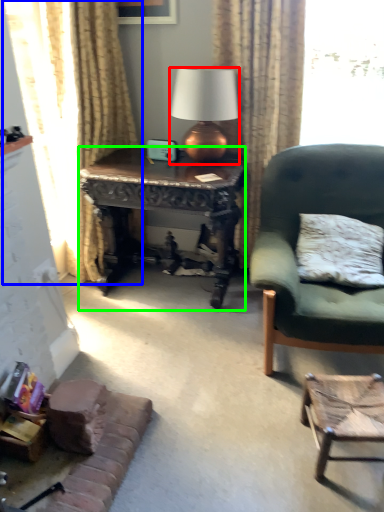
Question: Which object is the farthest from lamp (highlighted by a red box)? Choose among these: curtain (highlighted by a blue box) or desk (highlighted by a green box).

Choices:
 (A) curtain
 (B) desk

Answer: (A)